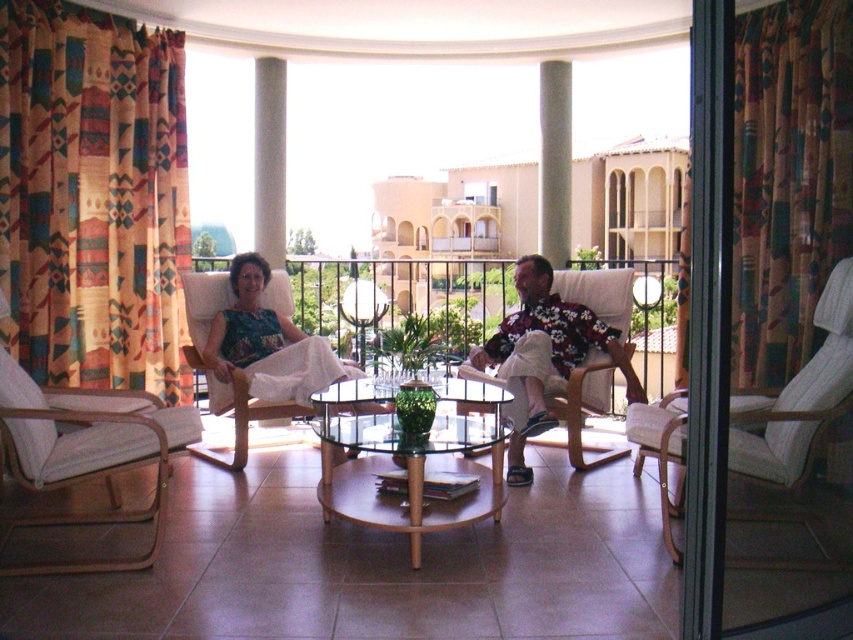
Question: Is multicolored fabric curtain at left positioned in front of white fabric armchair at right?

Choices:
 (A) no
 (B) yes

Answer: (A)

Question: Considering the real-world distances, which object is farthest from the matte floral dress at center?

Choices:
 (A) white fabric armchair at right
 (B) transparent glass door at right
 (C) multicolored fabric curtain at left
 (D) multicolored fabric curtain at right

Answer: (B)

Question: Among these points, which one is nearest to the camera?

Choices:
 (A) (303, 362)
 (B) (550, 348)
 (C) (712, 56)

Answer: (C)

Question: Among these points, which one is nearest to the camera?

Choices:
 (A) (670, 408)
 (B) (563, 308)
 (C) (300, 388)
 (D) (735, 74)

Answer: (A)

Question: Does white fabric armchair at right appear over floral fabric armchair at center?

Choices:
 (A) no
 (B) yes

Answer: (A)

Question: Does multicolored fabric curtain at left appear on the left side of matte floral shirt at center?

Choices:
 (A) no
 (B) yes

Answer: (B)